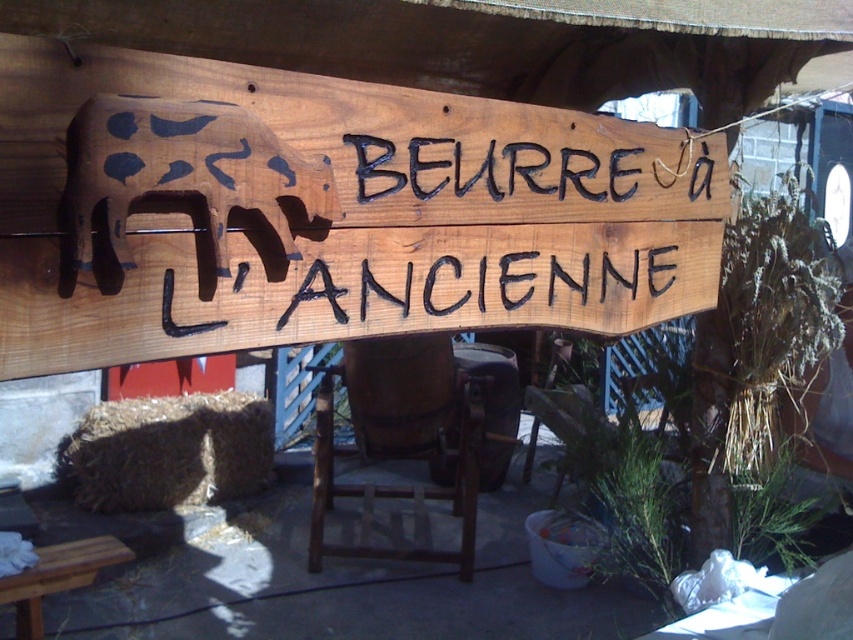
You are setting up a market stall and need to arrange items according to their positions. You have a brown wooden cow at left and a brown straw bale at lower left. Which object is placed more to the right side?

The brown wooden cow at left is positioned on the right side of brown straw bale at lower left, so it is more to the right.

You are a delivery person carrying a box that is 1.5 meters long. You need to place it between the brown straw bale at lower left and the wooden stool at lower left. Is there enough space?

The distance between the brown straw bale at lower left and the wooden stool at lower left is 1.25 meters. Since the box is 1.5 meters long, it will not fit in the available space.

Consider the image. You are standing in front of the rustic wooden signboard and want to place a small decoration between the two points, point (657, 224) and point (291, 212). Since you want the decoration to be visible from your current position, which point should the decoration be closer to?

The decoration should be closer to point (291, 212) because point (657, 224) is behind it, so placing the decoration near the front point ensures visibility.